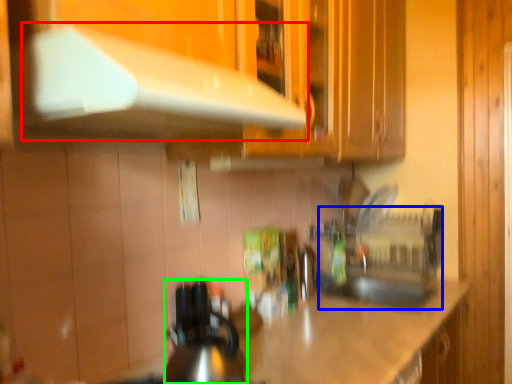
Question: Considering the real-world distances, which object is farthest from exhaust hood (highlighted by a red box)? sink (highlighted by a blue box) or kitchen appliance (highlighted by a green box)?

Choices:
 (A) sink
 (B) kitchen appliance

Answer: (A)